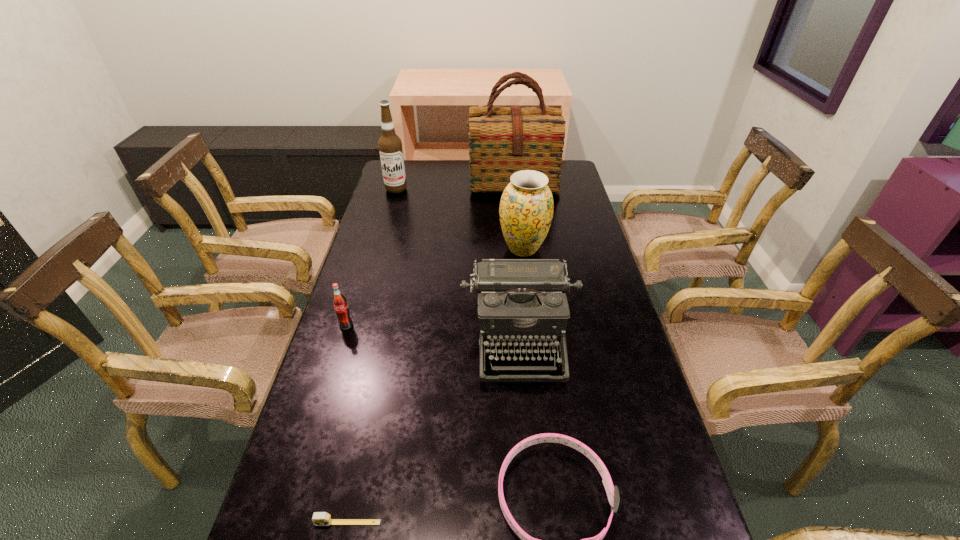
Find the location of `blank area located on the typing side of the typewriter`. blank area located on the typing side of the typewriter is located at coordinates (531, 469).

Where is `vacant region located on the label of the soda bottle`? vacant region located on the label of the soda bottle is located at coordinates (311, 440).

This screenshot has width=960, height=540. In order to click on shopping bag that is at the far edge in this screenshot , I will do `click(502, 140)`.

Find the location of a particular element. The width and height of the screenshot is (960, 540). alcohol positioned at the far edge is located at coordinates (390, 145).

Locate an element on the screen. This screenshot has height=540, width=960. alcohol situated at the left edge is located at coordinates (390, 145).

Locate an element on the screen. soda bottle that is at the left edge is located at coordinates (340, 304).

You are a GUI agent. You are given a task and a screenshot of the screen. Output one action in this format:
    pyautogui.click(x=<x>, y=<y>)
    Task: Click on the tape measure that is at the left edge
    
    Given the screenshot: What is the action you would take?
    pyautogui.click(x=319, y=518)

Find the location of a particular element. The image size is (960, 540). shopping bag located in the right edge section of the desktop is located at coordinates pyautogui.click(x=502, y=140).

Locate an element on the screen. Image resolution: width=960 pixels, height=540 pixels. typewriter located at the right edge is located at coordinates coord(521,302).

Locate an element on the screen. object located in the far left corner section of the desktop is located at coordinates (390, 145).